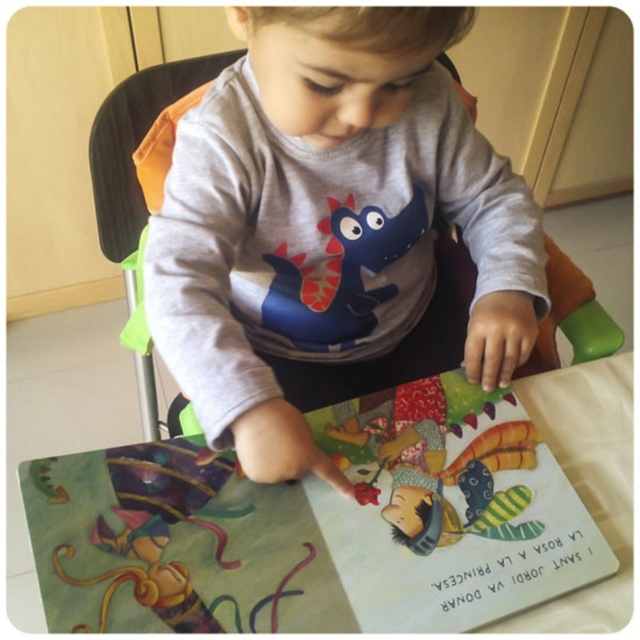
Is multicolored quilted book at center thinner than matte paper book at center?

In fact, multicolored quilted book at center might be wider than matte paper book at center.

Is point (486, 522) in front of point (516, 524)?

That is False.

Locate an element on the screen. This screenshot has width=640, height=640. multicolored quilted book at center is located at coordinates (445, 513).

Who is higher up, gray matte shirt at center or multicolored quilted book at center?

gray matte shirt at center is higher up.

Does point (278, 404) come farther from viewer compared to point (570, 520)?

No, (278, 404) is in front of (570, 520).

Find the location of a particular element. The image size is (640, 640). gray matte shirt at center is located at coordinates (330, 220).

Is gray matte shirt at center to the left of paper book at center from the viewer's perspective?

Correct, you'll find gray matte shirt at center to the left of paper book at center.

Consider the image. Does gray matte shirt at center have a smaller size compared to paper book at center?

No.

Image resolution: width=640 pixels, height=640 pixels. Describe the element at coordinates (330, 220) in the screenshot. I see `gray matte shirt at center` at that location.

At what (x,y) coordinates should I click in order to perform the action: click on gray matte shirt at center. Please return your answer as a coordinate pair (x, y). This screenshot has height=640, width=640. Looking at the image, I should click on (330, 220).